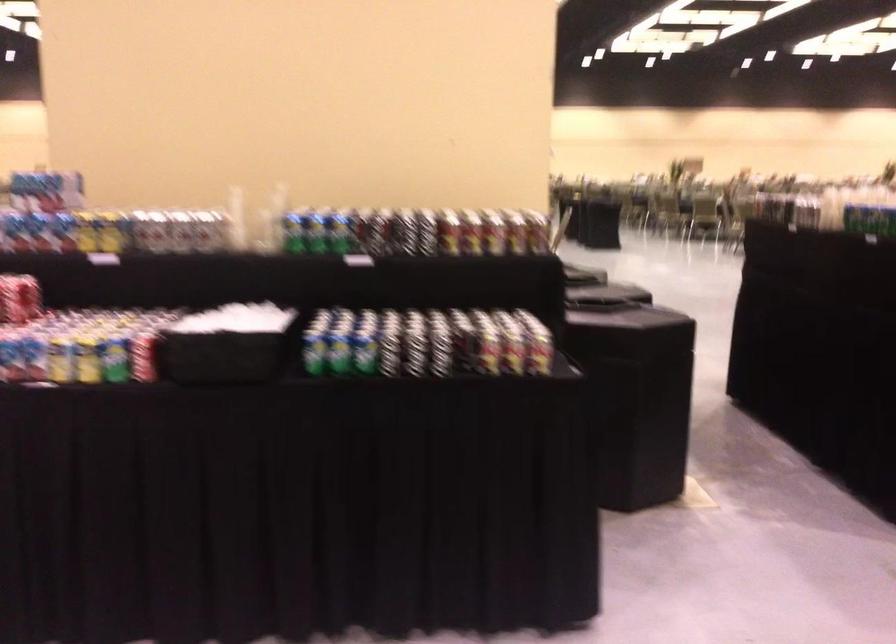
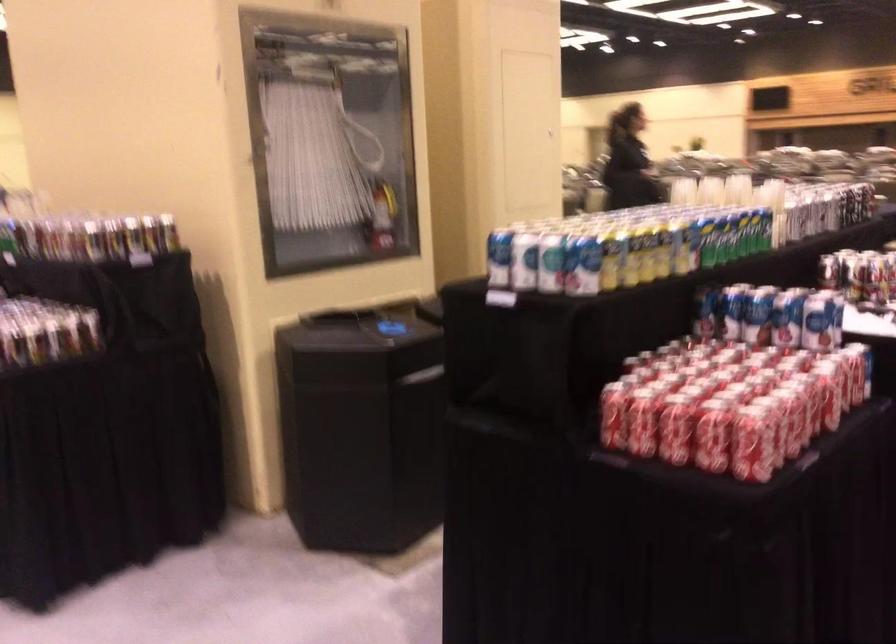
Where in the second image is the point corresponding to point (538, 234) from the first image?

(131, 254)